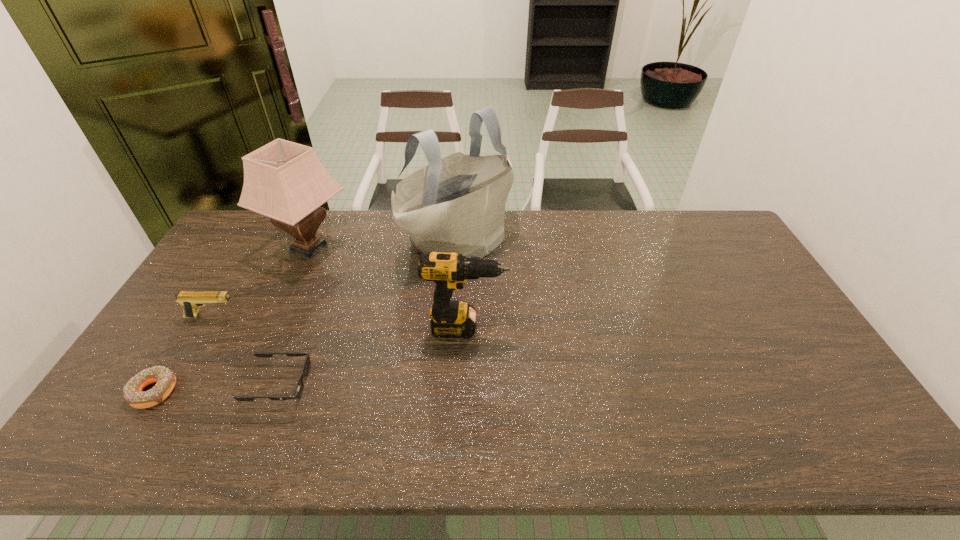
Find the location of a particular element. The image size is (960, 540). the tallest object is located at coordinates (456, 204).

The width and height of the screenshot is (960, 540). I want to click on the second tallest object, so click(x=283, y=180).

The width and height of the screenshot is (960, 540). In order to click on drill in this screenshot , I will do `click(450, 319)`.

You are a GUI agent. You are given a task and a screenshot of the screen. Output one action in this format:
    pyautogui.click(x=<x>, y=<y>)
    Task: Click on the pistol
    The width and height of the screenshot is (960, 540).
    Given the screenshot: What is the action you would take?
    pyautogui.click(x=190, y=300)

Where is `doughnut`? doughnut is located at coordinates (x=134, y=396).

Image resolution: width=960 pixels, height=540 pixels. I want to click on sunglasses, so click(x=298, y=390).

This screenshot has width=960, height=540. Identify the location of vacant space located 0.240m on the front of the tallest object. (452, 335).

Locate an element on the screen. The image size is (960, 540). vacant region located 0.140m on the front of the lampshade is located at coordinates (281, 309).

Locate an element on the screen. The width and height of the screenshot is (960, 540). free location located at the tip of the drill is located at coordinates (575, 327).

You are a GUI agent. You are given a task and a screenshot of the screen. Output one action in this format:
    pyautogui.click(x=<x>, y=<y>)
    Task: Click on the free spot located at the barrel of the pistol
    
    Given the screenshot: What is the action you would take?
    pyautogui.click(x=303, y=317)